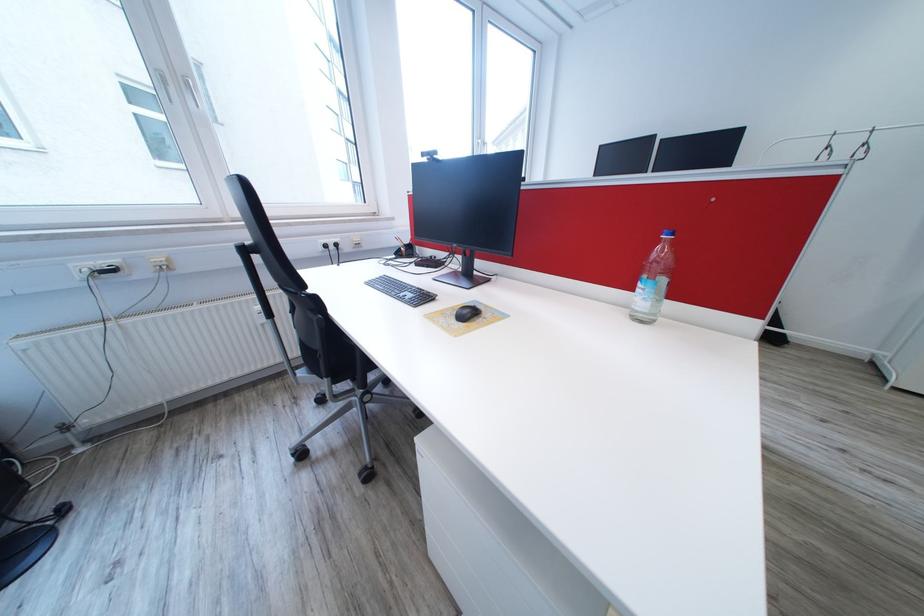
Identify the location of chair sitting surface. Image resolution: width=924 pixels, height=616 pixels. (342, 354).